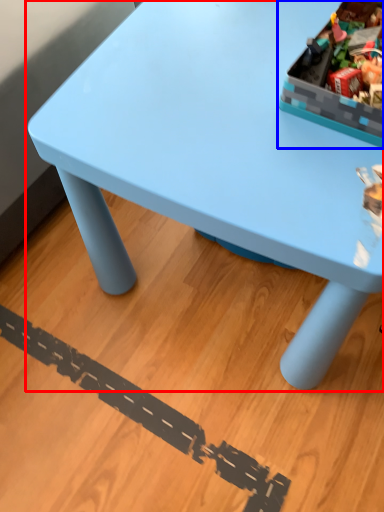
Question: Which of the following is the farthest to the observer, table (highlighted by a red box) or storage box (highlighted by a blue box)?

Choices:
 (A) table
 (B) storage box

Answer: (B)